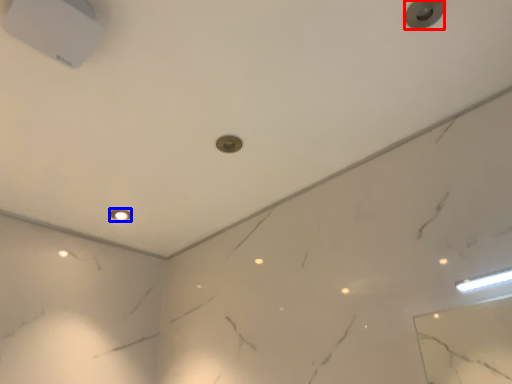
Question: Which of the following is the closest to the observer, knob (highlighted by a red box) or dot (highlighted by a blue box)?

Choices:
 (A) knob
 (B) dot

Answer: (A)